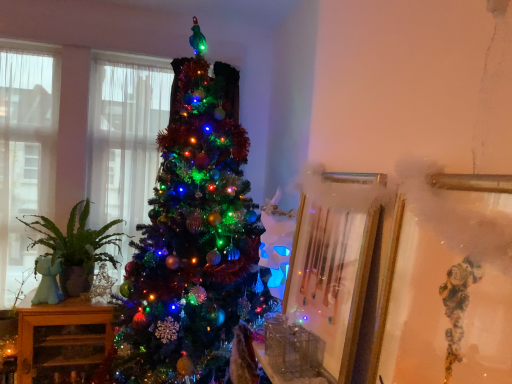
Question: Is gold metallic picture frame at center-right, which is the 1th picture frame from back to front, smaller than clear glass window at left, acting as the 2th window starting from the right?

Choices:
 (A) yes
 (B) no

Answer: (A)

Question: Is gold metallic picture frame at center-right, which is the 1th picture frame from back to front, not close to clear glass window at left, the 1th window in the left-to-right sequence?

Choices:
 (A) no
 (B) yes

Answer: (B)

Question: Is gold metallic picture frame at center-right, which is the 1th picture frame from back to front, in contact with clear glass window at left, acting as the 2th window starting from the right?

Choices:
 (A) yes
 (B) no

Answer: (B)

Question: Can clear glass window at left, the 1th window in the left-to-right sequence, be found inside gold metallic picture frame at center-right, which is the 1th picture frame from back to front?

Choices:
 (A) yes
 (B) no

Answer: (B)

Question: From a real-world perspective, does gold metallic picture frame at center-right, the 2th picture frame when ordered from front to back, sit lower than clear glass window at left, the 1th window in the left-to-right sequence?

Choices:
 (A) no
 (B) yes

Answer: (B)

Question: In the image, is wooden cabinet at left positioned in front of or behind clear glass window at left, acting as the 2th window starting from the right?

Choices:
 (A) front
 (B) behind

Answer: (A)

Question: Is wooden cabinet at left bigger or smaller than clear glass window at left, the 1th window in the left-to-right sequence?

Choices:
 (A) small
 (B) big

Answer: (B)

Question: Considering the positions of wooden cabinet at left and clear glass window at left, the 1th window in the left-to-right sequence, in the image, is wooden cabinet at left taller or shorter than clear glass window at left, the 1th window in the left-to-right sequence,?

Choices:
 (A) short
 (B) tall

Answer: (A)

Question: Is wooden cabinet at left spatially inside clear glass window at left, acting as the 2th window starting from the right, or outside of it?

Choices:
 (A) outside
 (B) inside

Answer: (A)

Question: Is shiny green tinsel at center in front of or behind gold metallic picture frame at right, which ranks as the 2th picture frame in back-to-front order, in the image?

Choices:
 (A) behind
 (B) front

Answer: (A)

Question: Is point (226, 218) closer or farther from the camera than point (426, 182)?

Choices:
 (A) closer
 (B) farther

Answer: (B)

Question: In terms of height, does shiny green tinsel at center look taller or shorter compared to gold metallic picture frame at right, which ranks as the 2th picture frame in back-to-front order?

Choices:
 (A) short
 (B) tall

Answer: (B)

Question: Choose the correct answer: Is shiny green tinsel at center inside gold metallic picture frame at right, which ranks as the 2th picture frame in back-to-front order, or outside it?

Choices:
 (A) outside
 (B) inside

Answer: (A)

Question: Considering the positions of point (344, 225) and point (96, 200), is point (344, 225) closer or farther from the camera than point (96, 200)?

Choices:
 (A) closer
 (B) farther

Answer: (A)

Question: In terms of width, does gold metallic picture frame at center-right, which is the 1th picture frame from back to front, look wider or thinner when compared to translucent fabric window at left, marked as the 2th window in a left-to-right arrangement?

Choices:
 (A) thin
 (B) wide

Answer: (A)